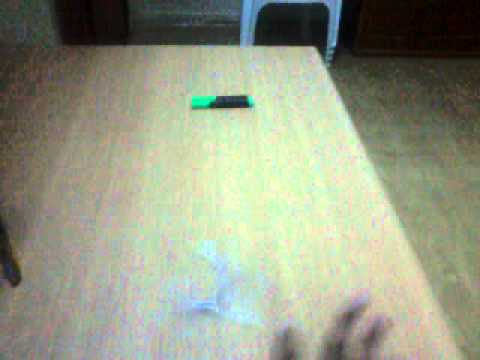
You are a GUI agent. You are given a task and a screenshot of the screen. Output one action in this format:
    pyautogui.click(x=<x>, y=<y>)
    Task: Click on the empty area under stacked chairs
    This screenshot has width=480, height=360.
    Given the screenshot: What is the action you would take?
    pyautogui.click(x=293, y=25)